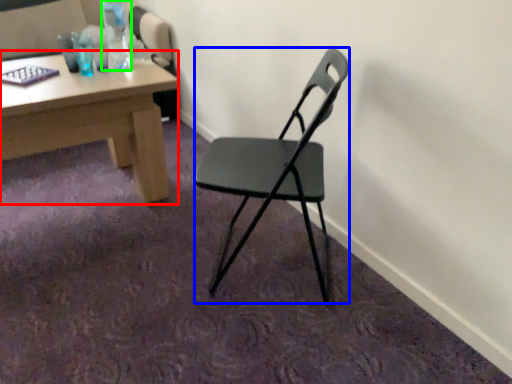
Question: Based on their relative distances, which object is farther from desk (highlighted by a red box)? Choose from chair (highlighted by a blue box) and bottle (highlighted by a green box).

Choices:
 (A) chair
 (B) bottle

Answer: (A)